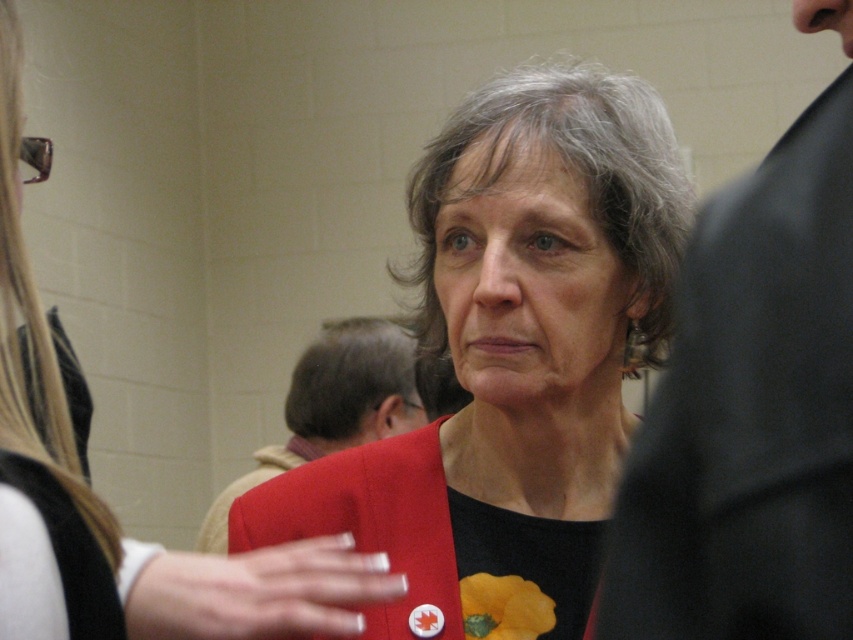
Question: Considering the relative positions of matte black suit at right and matte red coat at center in the image provided, where is matte black suit at right located with respect to matte red coat at center?

Choices:
 (A) left
 (B) right

Answer: (B)

Question: Which point appears closest to the camera in this image?

Choices:
 (A) (397, 496)
 (B) (228, 618)
 (C) (837, 381)

Answer: (C)

Question: Is the position of matte red jacket at center less distant than that of matte black suit at right?

Choices:
 (A) yes
 (B) no

Answer: (B)

Question: Can you confirm if matte red jacket at center is wider than matte red coat at center?

Choices:
 (A) no
 (B) yes

Answer: (B)

Question: Which point appears closest to the camera in this image?

Choices:
 (A) (431, 604)
 (B) (827, 172)
 (C) (289, 586)

Answer: (B)

Question: Which of these objects is positioned closest to the matte red coat at center?

Choices:
 (A) matte red jacket at center
 (B) matte black suit at right

Answer: (A)